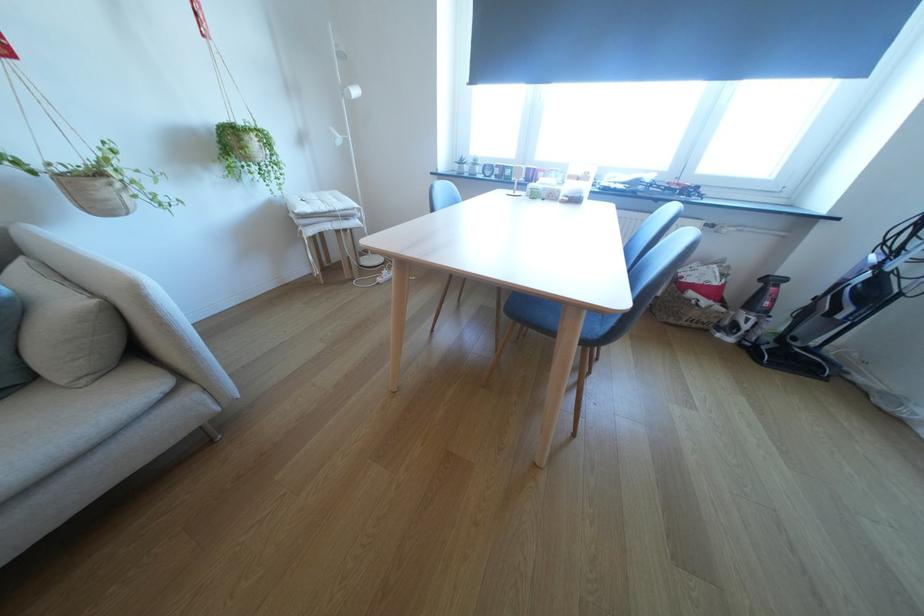
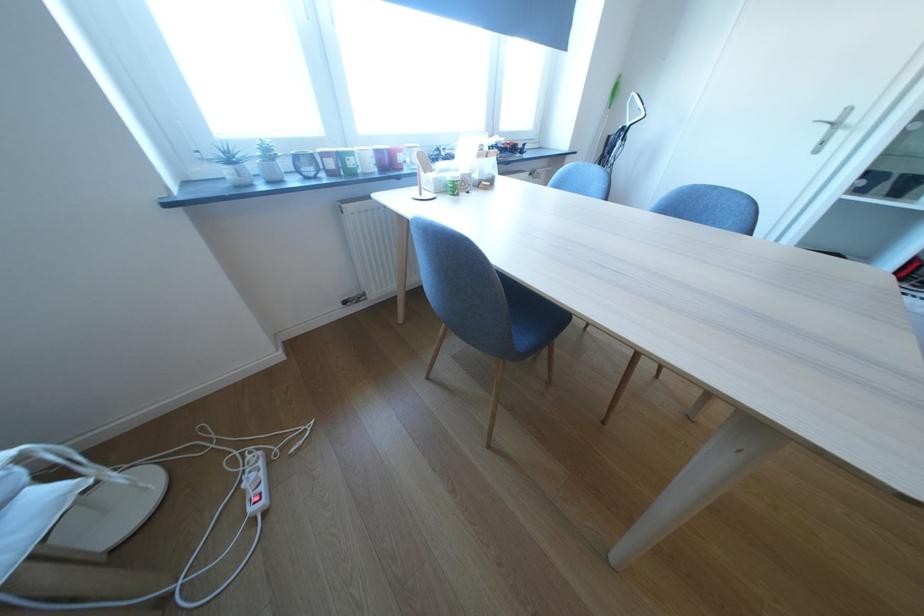
Find the pixel in the second image that matches point (469, 169) in the first image.

(249, 175)